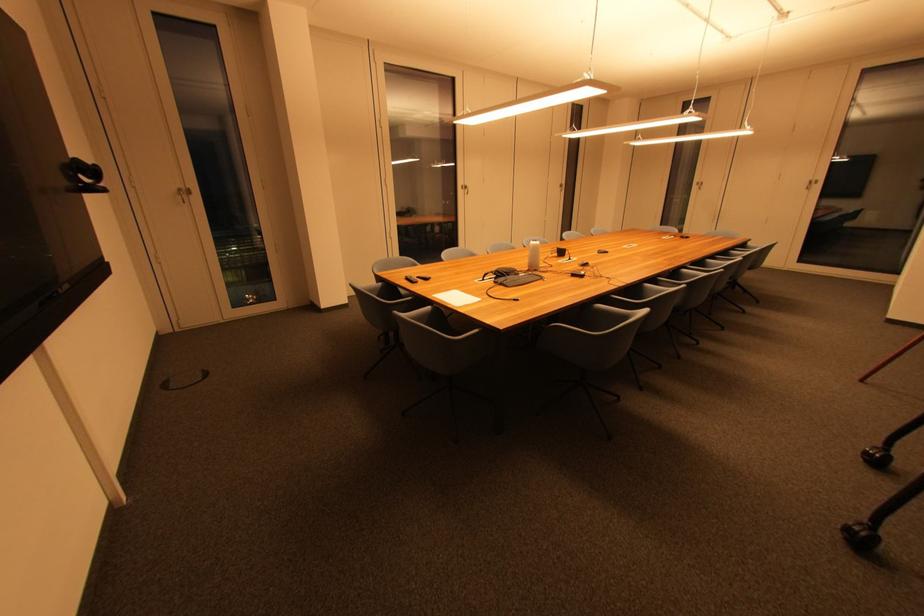
The width and height of the screenshot is (924, 616). Identify the location of gray chair sitting surface. (378, 288).